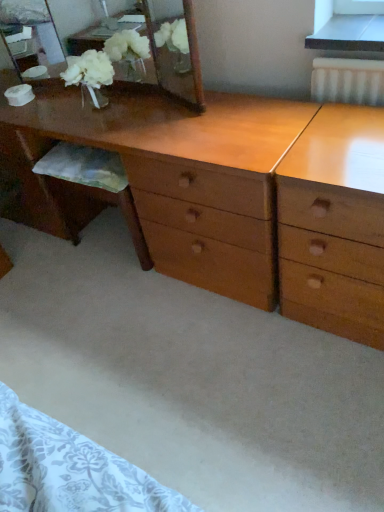
Question: Is light brown wood desk at center looking in the opposite direction of wooden mirror at upper left?

Choices:
 (A) no
 (B) yes

Answer: (A)

Question: From a real-world perspective, does light brown wood desk at center stand above wooden mirror at upper left?

Choices:
 (A) no
 (B) yes

Answer: (A)

Question: From the image's perspective, is light brown wood desk at center under wooden mirror at upper left?

Choices:
 (A) no
 (B) yes

Answer: (B)

Question: Does light brown wood desk at center turn towards wooden mirror at upper left?

Choices:
 (A) yes
 (B) no

Answer: (B)

Question: Is light brown wood desk at center to the right of wooden mirror at upper left from the viewer's perspective?

Choices:
 (A) no
 (B) yes

Answer: (B)

Question: Is the position of light brown wood desk at center less distant than that of wooden mirror at upper left?

Choices:
 (A) no
 (B) yes

Answer: (B)

Question: Does wooden mirror at upper left contain light brown wood desk at center?

Choices:
 (A) no
 (B) yes

Answer: (A)

Question: From a real-world perspective, does wooden mirror at upper left stand above light brown wood desk at center?

Choices:
 (A) yes
 (B) no

Answer: (A)

Question: Is wooden mirror at upper left facing away from light brown wood desk at center?

Choices:
 (A) yes
 (B) no

Answer: (B)

Question: Does wooden mirror at upper left have a greater height compared to light brown wood desk at center?

Choices:
 (A) yes
 (B) no

Answer: (B)

Question: From the image's perspective, is wooden mirror at upper left on light brown wood desk at center?

Choices:
 (A) yes
 (B) no

Answer: (A)

Question: Does wooden mirror at upper left appear on the right side of light brown wood desk at center?

Choices:
 (A) yes
 (B) no

Answer: (B)

Question: Considering the positions of wooden mirror at upper left and light brown wood desk at center in the image, is wooden mirror at upper left taller or shorter than light brown wood desk at center?

Choices:
 (A) short
 (B) tall

Answer: (A)